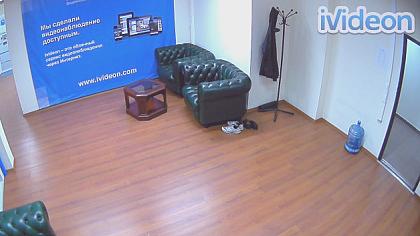
At what (x,y) coordinates should I click in order to perform the action: click on white wall. Please return your answer as a coordinate pair (x, y). The image size is (420, 236). Looking at the image, I should click on (347, 59), (308, 63), (229, 33).